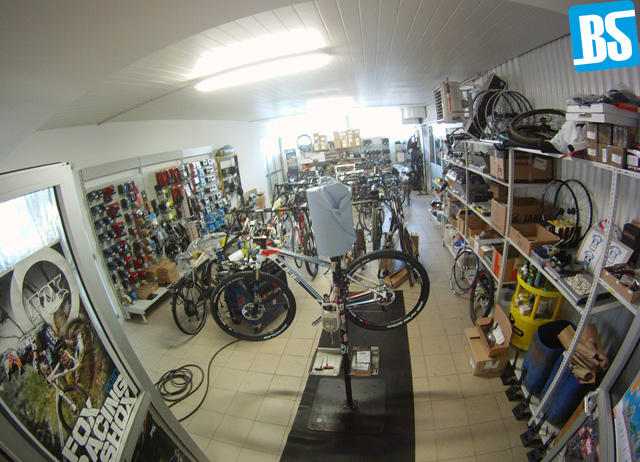
Where is `door`? This screenshot has height=462, width=640. door is located at coordinates (148, 381).